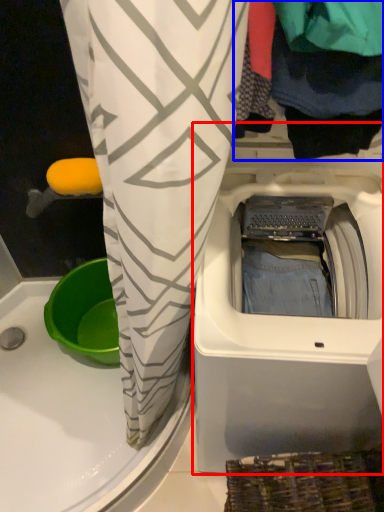
Question: Among these objects, which one is farthest to the camera, washing machine (highlighted by a red box) or clothing (highlighted by a blue box)?

Choices:
 (A) washing machine
 (B) clothing

Answer: (A)